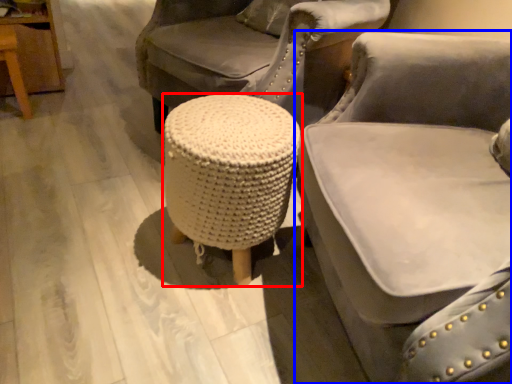
Question: Which object appears closest to the camera in this image, stool (highlighted by a red box) or chair (highlighted by a blue box)?

Choices:
 (A) stool
 (B) chair

Answer: (B)